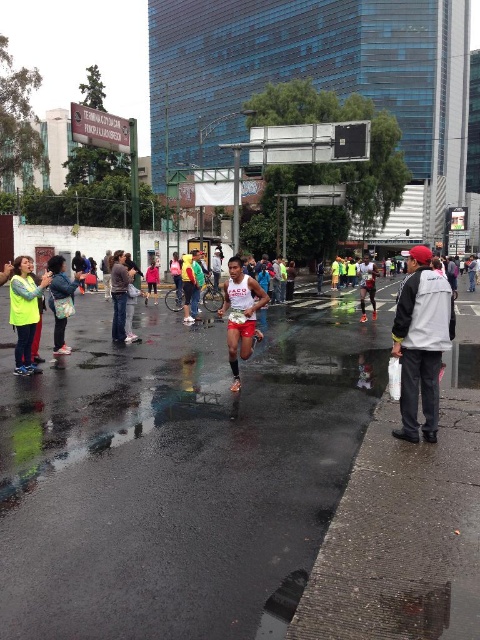
Question: Which object appears farthest from the camera in this image?

Choices:
 (A) white jacket at right
 (B) pink fabric jacket at center
 (C) matte black shorts at center

Answer: (B)

Question: Is neon yellow vest at left smaller than dark gray sweater at center?

Choices:
 (A) no
 (B) yes

Answer: (B)

Question: Does white jacket at right have a larger size compared to matte black shorts at center?

Choices:
 (A) no
 (B) yes

Answer: (A)

Question: Does red matte shorts at center lie behind pink fabric jacket at center?

Choices:
 (A) no
 (B) yes

Answer: (A)

Question: Which point appears farthest from the camera in this image?

Choices:
 (A) (364, 312)
 (B) (156, 292)

Answer: (B)

Question: Among these points, which one is farthest from the camera?

Choices:
 (A) (15, 266)
 (B) (362, 298)
 (C) (120, 276)

Answer: (B)